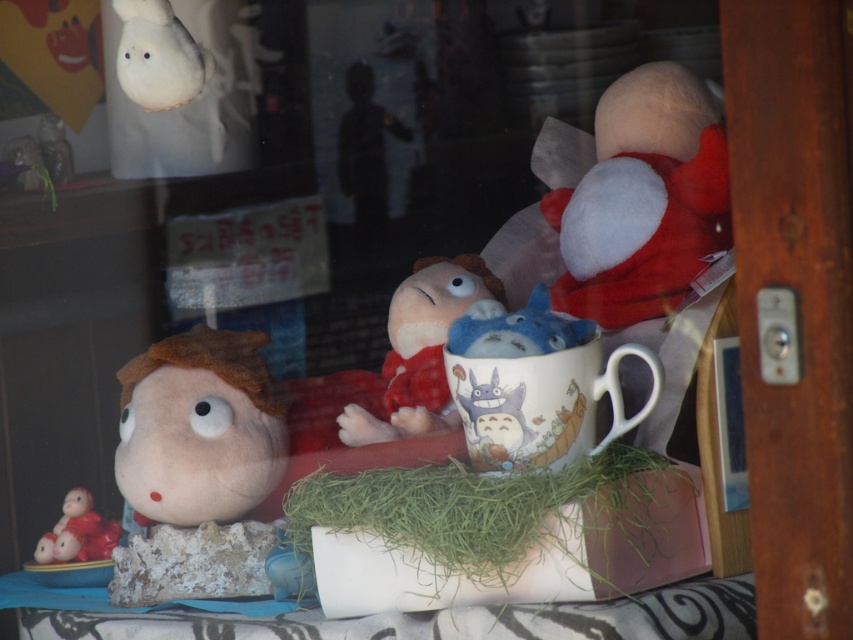
You are a customer in the store and want to know if the fuzzy beige doll at left can fit into the white glossy mug at center. Can it fit?

The fuzzy beige doll at left is larger in size than the white glossy mug at center, so it cannot fit inside the mug.

You are a photographer standing at the camera position. You want to take a clear photo of the white plush toy at upper right. Can you move closer to it to get a better shot?

The white plush toy at upper right and camera are 3.87 feet apart from each other, so you can move closer to it to get a better shot as long as you stay within the 3.87 feet distance.

You are a delivery person who needs to place a new 12 inch long package between the white glossy mug at center and the matte red figurine at lower left. Can you fit it there without moving either item?

The distance between the white glossy mug at center and the matte red figurine at lower left is 11.73 inches. Since the package is 12 inches long, it cannot fit between them without moving either item.